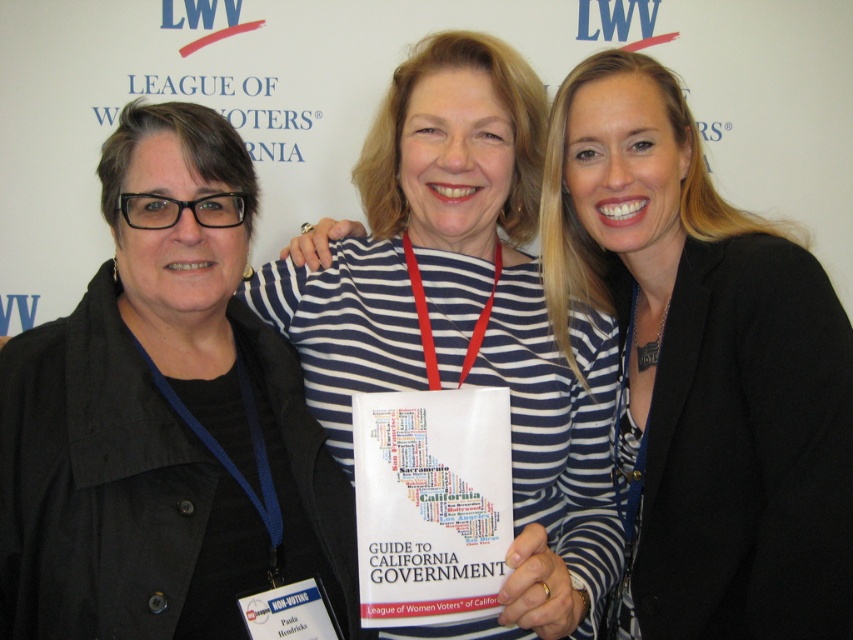
Question: Is black matte jacket at left behind striped fabric shirt at center?

Choices:
 (A) no
 (B) yes

Answer: (A)

Question: Is black matte jacket at left above striped fabric shirt at center?

Choices:
 (A) yes
 (B) no

Answer: (B)

Question: Which of the following is the closest to the observer?

Choices:
 (A) black matte jacket at left
 (B) striped fabric shirt at center

Answer: (A)

Question: Where is black matte jacket at left located in relation to striped fabric shirt at center in the image?

Choices:
 (A) above
 (B) below

Answer: (B)

Question: Which point appears farthest from the camera in this image?

Choices:
 (A) pos(828,397)
 (B) pos(137,371)

Answer: (A)